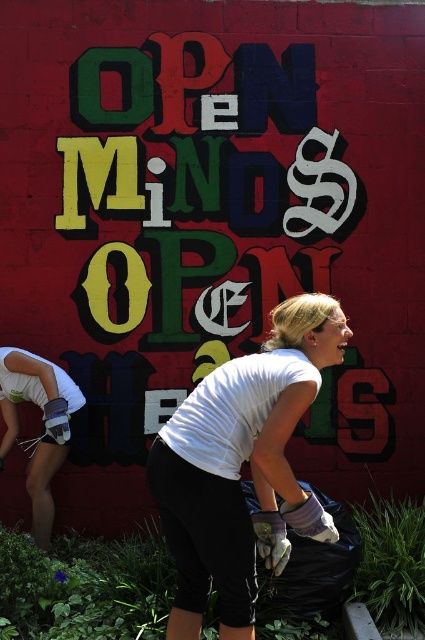
Question: Which object appears farthest from the camera in this image?

Choices:
 (A) white matte gloves at lower left
 (B) white matte shirt at center

Answer: (A)

Question: Is white matte shirt at center bigger than white matte gloves at lower left?

Choices:
 (A) yes
 (B) no

Answer: (A)

Question: Is white matte shirt at center thinner than white matte gloves at lower left?

Choices:
 (A) no
 (B) yes

Answer: (A)

Question: Is white matte shirt at center smaller than white matte gloves at lower left?

Choices:
 (A) yes
 (B) no

Answer: (B)

Question: Which point is farther from the camera taking this photo?

Choices:
 (A) (342, 352)
 (B) (50, 380)

Answer: (B)